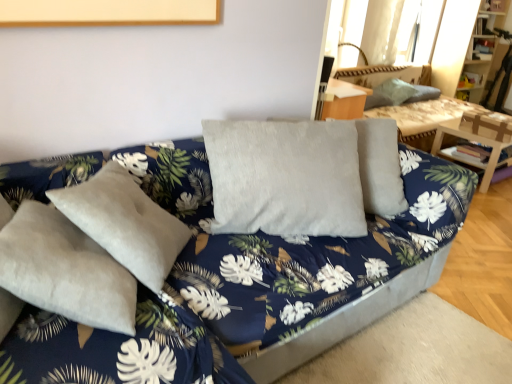
Question: Should I look upward or downward to see velvet gray couch at center?

Choices:
 (A) up
 (B) down

Answer: (B)

Question: Does velvet green pillow at upper right have a greater height compared to wooden table at right?

Choices:
 (A) yes
 (B) no

Answer: (B)

Question: Is velvet green pillow at upper right outside of wooden table at right?

Choices:
 (A) no
 (B) yes

Answer: (B)

Question: Considering the relative positions of velvet green pillow at upper right and wooden table at right in the image provided, is velvet green pillow at upper right to the left of wooden table at right from the viewer's perspective?

Choices:
 (A) no
 (B) yes

Answer: (B)

Question: Is velvet green pillow at upper right next to wooden table at right?

Choices:
 (A) yes
 (B) no

Answer: (B)

Question: Does velvet green pillow at upper right have a lesser width compared to wooden table at right?

Choices:
 (A) yes
 (B) no

Answer: (A)

Question: Considering the relative positions of velvet green pillow at upper right and wooden table at right in the image provided, is velvet green pillow at upper right in front of wooden table at right?

Choices:
 (A) no
 (B) yes

Answer: (A)

Question: Is velvet green pillow at upper right positioned far away from velvet gray pillows at upper right?

Choices:
 (A) yes
 (B) no

Answer: (B)

Question: From the image's perspective, would you say velvet green pillow at upper right is shown under velvet gray pillows at upper right?

Choices:
 (A) no
 (B) yes

Answer: (A)

Question: From the image's perspective, is velvet green pillow at upper right over velvet gray pillows at upper right?

Choices:
 (A) no
 (B) yes

Answer: (B)

Question: Does velvet green pillow at upper right have a greater width compared to velvet gray pillows at upper right?

Choices:
 (A) yes
 (B) no

Answer: (B)

Question: Does velvet green pillow at upper right have a smaller size compared to velvet gray pillows at upper right?

Choices:
 (A) yes
 (B) no

Answer: (A)

Question: From a real-world perspective, is velvet green pillow at upper right positioned over velvet gray pillows at upper right based on gravity?

Choices:
 (A) no
 (B) yes

Answer: (B)

Question: Is velvet gray pillows at upper right further to camera compared to translucent fabric curtain at upper right?

Choices:
 (A) yes
 (B) no

Answer: (B)